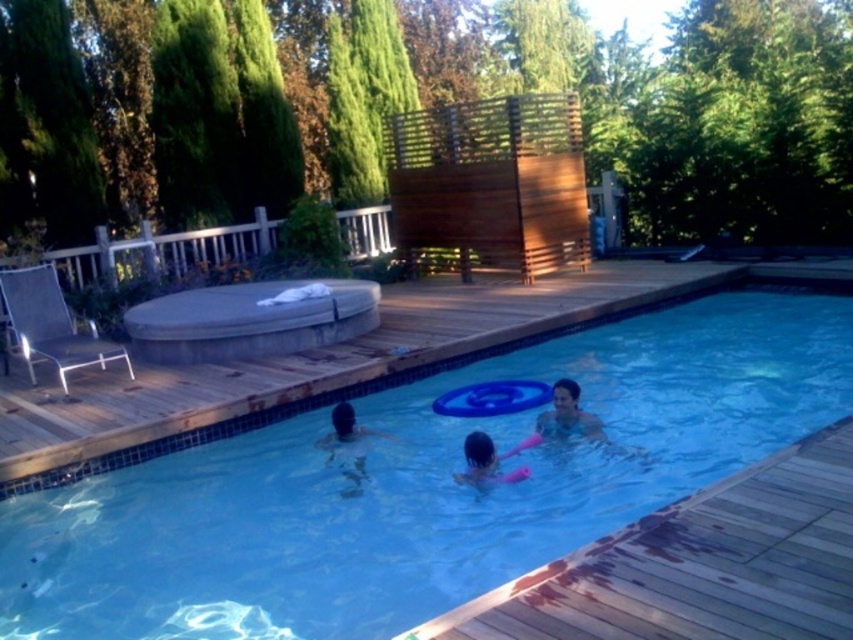
You are a maintenance worker needing to reach both the wooden deck at lower right and the pink rubber at center. Which object will require you to climb down from your current position?

The wooden deck at lower right has a greater height compared to the pink rubber at center, so you will need to climb down to reach the pink rubber at center.

From the picture: You are a maintenance worker needing to place a 2.0 meter long safety barrier between the wooden deck at lower right and the pink rubber at center. Based on the scene, will the barrier fit without overlapping either object?

The distance between wooden deck at lower right and pink rubber at center is 1.90 meters. Since the barrier is 2.0 meters long, it will not fit as it is 0.10 meters longer than the available space.